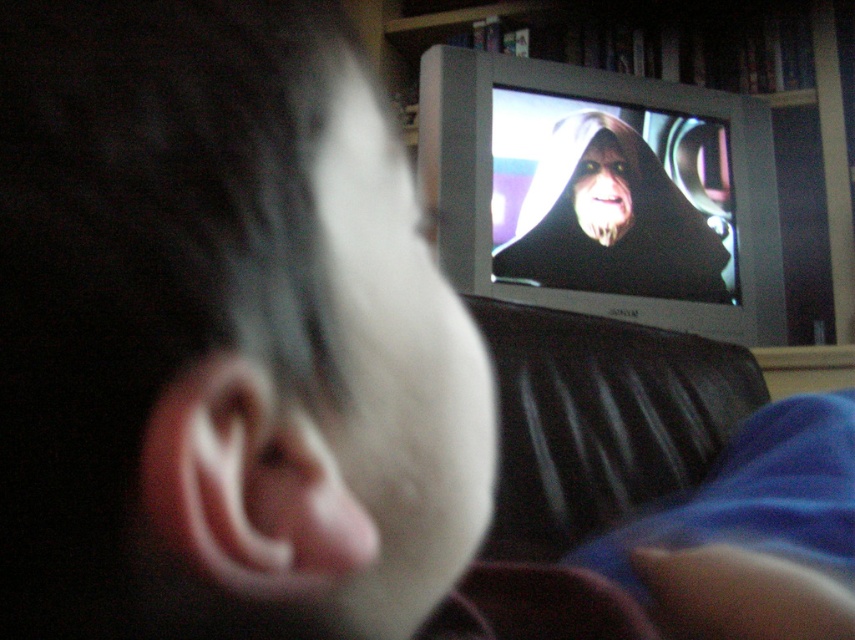
Is white matte pillow at center shorter than matte black face at center?

Indeed, white matte pillow at center has a lesser height compared to matte black face at center.

Does white matte pillow at center come in front of matte black face at center?

Yes, it is.

Between point (398, 620) and point (621, 230), which one is positioned behind?

Point (621, 230)

Locate an element on the screen. Image resolution: width=855 pixels, height=640 pixels. white matte pillow at center is located at coordinates (391, 392).

Is white matte pillow at center shorter than matte black hood at upper center?

Yes, white matte pillow at center is shorter than matte black hood at upper center.

In the scene shown: Does white matte pillow at center have a greater width compared to matte black hood at upper center?

No.

Is point (452, 509) behind point (529, 218)?

No, it is not.

Locate an element on the screen. The width and height of the screenshot is (855, 640). white matte pillow at center is located at coordinates (391, 392).

Consider the image. Can you confirm if wooden bookshelf at upper center is smaller than white matte pillow at center?

No.

This screenshot has height=640, width=855. What do you see at coordinates (628, 164) in the screenshot?
I see `wooden bookshelf at upper center` at bounding box center [628, 164].

You are a GUI agent. You are given a task and a screenshot of the screen. Output one action in this format:
    pyautogui.click(x=<x>, y=<y>)
    Task: Click on the wooden bookshelf at upper center
    Image resolution: width=855 pixels, height=640 pixels.
    Given the screenshot: What is the action you would take?
    pyautogui.click(x=628, y=164)